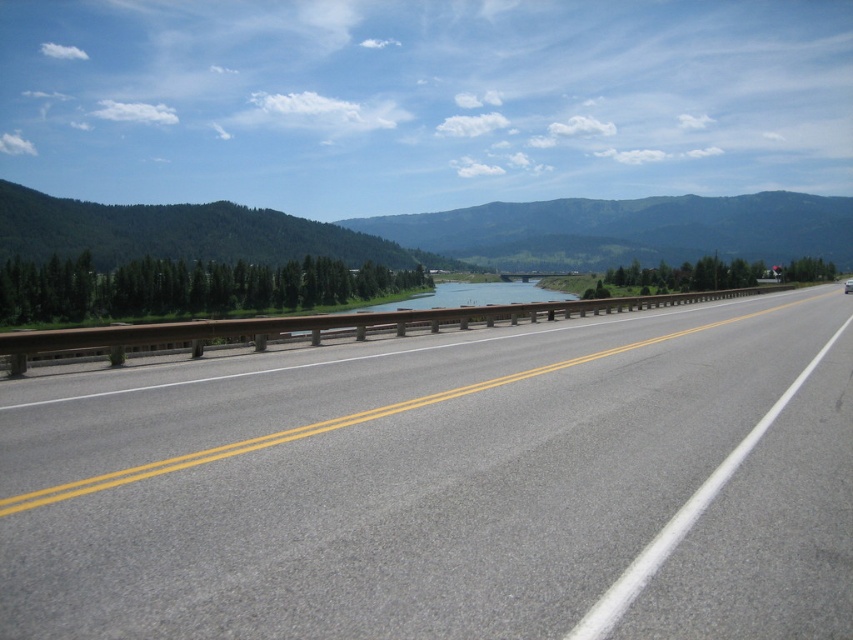
Does gray asphalt highway at center have a lesser width compared to metallic gray bridge at center?

Indeed, gray asphalt highway at center has a lesser width compared to metallic gray bridge at center.

Who is taller, gray asphalt highway at center or metallic gray bridge at center?

metallic gray bridge at center is taller.

You are a GUI agent. You are given a task and a screenshot of the screen. Output one action in this format:
    pyautogui.click(x=<x>, y=<y>)
    Task: Click on the gray asphalt highway at center
    The height and width of the screenshot is (640, 853).
    Given the screenshot: What is the action you would take?
    pyautogui.click(x=380, y=474)

Does green textured mountain at center have a greater height compared to metallic gray bridge at center?

Yes.

Between point (653, 214) and point (436, 332), which one is positioned behind?

The point (653, 214) is more distant.

The width and height of the screenshot is (853, 640). Identify the location of green textured mountain at center. (627, 230).

Does point (311, 458) lie behind point (415, 228)?

That is False.

Can you confirm if gray asphalt highway at center is positioned below green textured mountain at center?

Indeed, gray asphalt highway at center is positioned under green textured mountain at center.

Between point (152, 419) and point (358, 230), which one is positioned behind?

The point (358, 230) is behind.

Identify the location of gray asphalt highway at center. The image size is (853, 640). (380, 474).